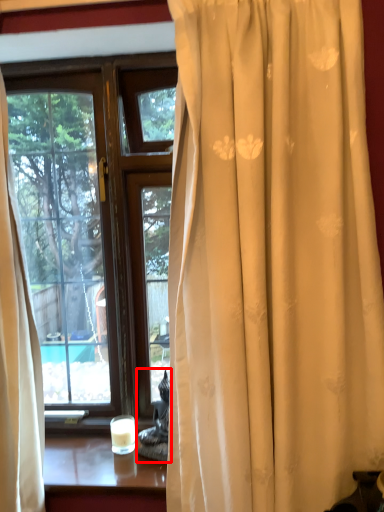
Question: Where is chair (annotated by the red box) located in relation to candle holder in the image?

Choices:
 (A) right
 (B) left

Answer: (A)